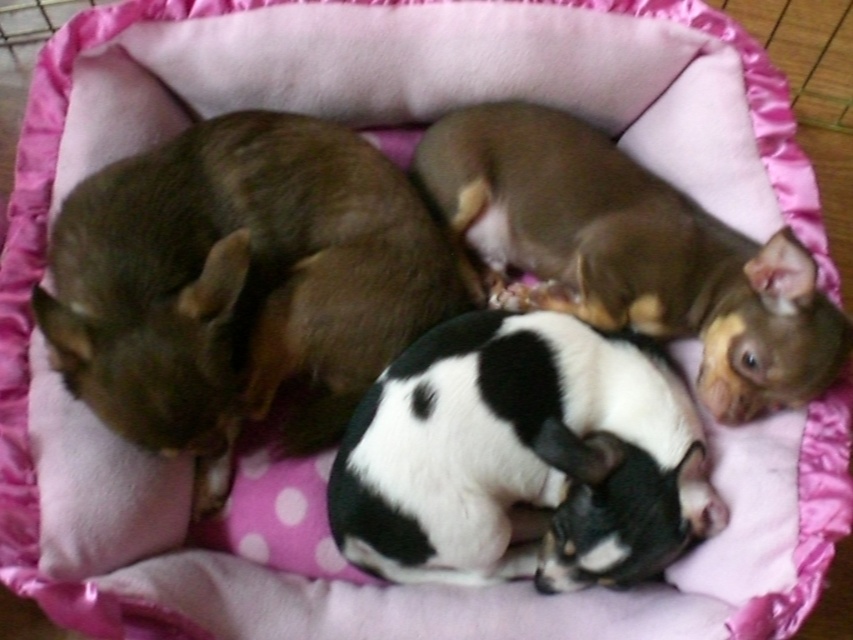
Can you confirm if brown fur dog at left is positioned to the left of black and white fur at center?

Indeed, brown fur dog at left is positioned on the left side of black and white fur at center.

Is brown fur dog at left bigger than black and white fur at center?

Indeed, brown fur dog at left has a larger size compared to black and white fur at center.

Describe the element at coordinates (239, 284) in the screenshot. I see `brown fur dog at left` at that location.

Find the location of `brown fur dog at left`. brown fur dog at left is located at coordinates (239, 284).

Which of these two, brown fur dog at left or brown furry dog at upper right, stands taller?

brown fur dog at left

Consider the image. Can you confirm if brown fur dog at left is positioned below brown furry dog at upper right?

Indeed, brown fur dog at left is positioned under brown furry dog at upper right.

What do you see at coordinates (239, 284) in the screenshot? This screenshot has width=853, height=640. I see `brown fur dog at left` at bounding box center [239, 284].

Where is `brown fur dog at left`? This screenshot has width=853, height=640. brown fur dog at left is located at coordinates (239, 284).

Describe the element at coordinates (521, 458) in the screenshot. I see `black and white fur at center` at that location.

Who is lower down, black and white fur at center or brown furry dog at upper right?

black and white fur at center is below.

Is point (364, 566) positioned behind point (601, 132)?

No, it is in front of (601, 132).

This screenshot has width=853, height=640. What are the coordinates of `black and white fur at center` in the screenshot? It's located at (521, 458).